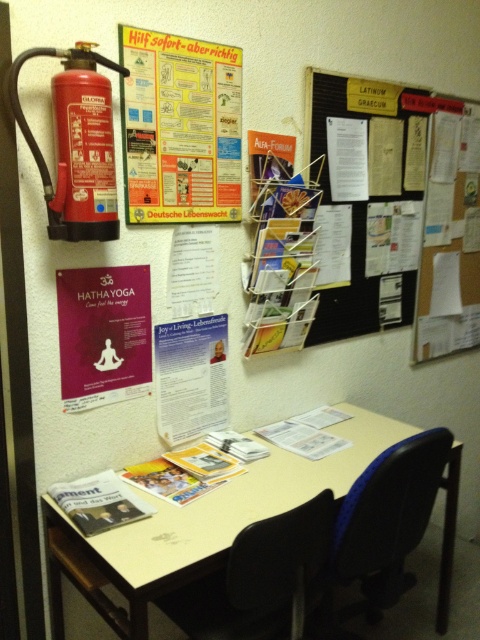
Question: Is white plastic table at center below white paper poster at center?

Choices:
 (A) yes
 (B) no

Answer: (A)

Question: Does blue fabric swivel chair at lower right appear under white paper poster at center?

Choices:
 (A) yes
 (B) no

Answer: (A)

Question: In this image, where is orange paper poster at upper center located relative to blue fabric swivel chair at lower right?

Choices:
 (A) below
 (B) above

Answer: (B)

Question: Based on their relative distances, which object is nearer to the white paper poster at center?

Choices:
 (A) white plastic table at center
 (B) white paper poster at upper right
 (C) red matte fire extinguisher at upper left
 (D) blue fabric swivel chair at lower right

Answer: (A)

Question: Which point is farther to the camera?

Choices:
 (A) (156, 186)
 (B) (407, 216)

Answer: (B)

Question: Which object is positioned farthest from the white paper poster at upper right?

Choices:
 (A) black plastic swivel chair at lower center
 (B) blue fabric swivel chair at lower right
 (C) orange paper poster at upper center

Answer: (A)